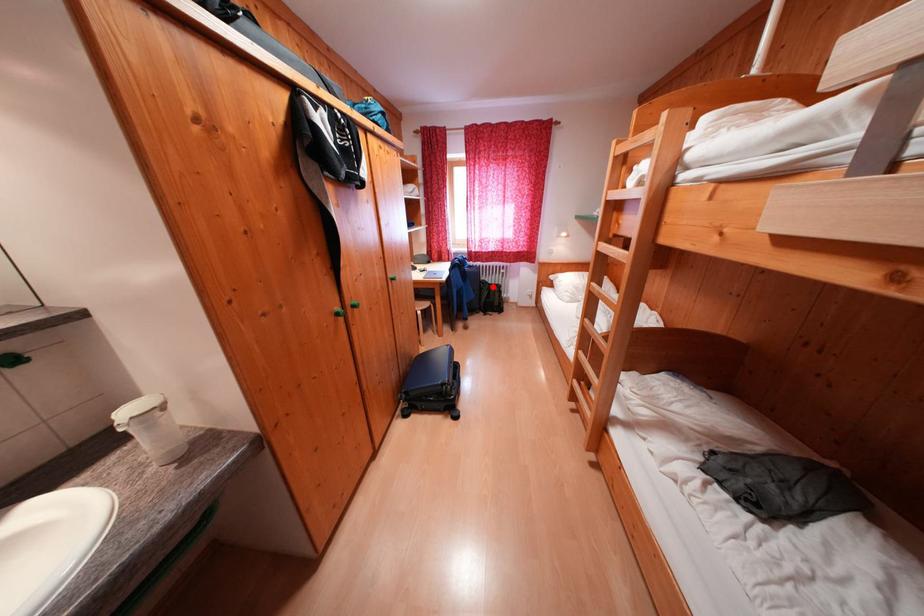
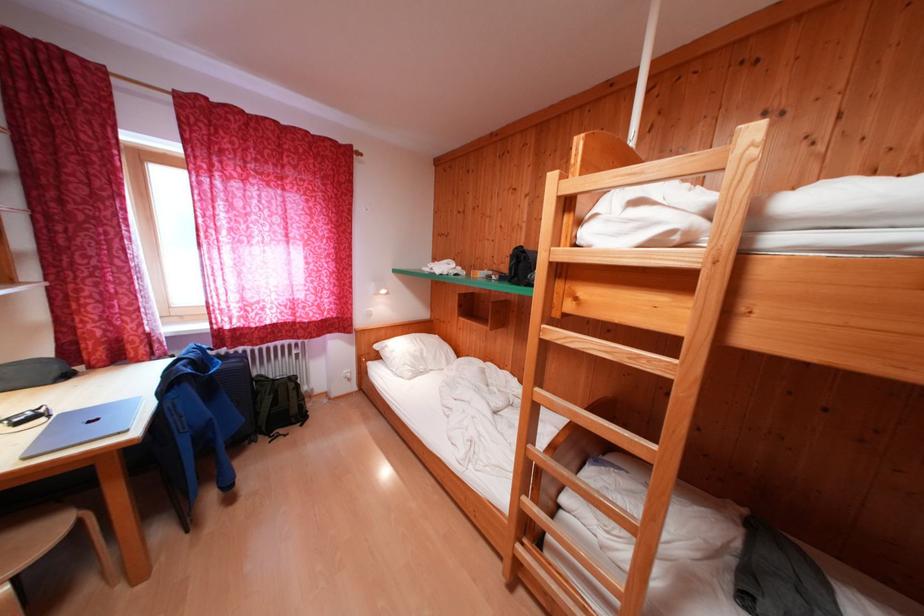
Locate, in the second image, the point that corresponds to the highlighted location in the first image.

(271, 383)